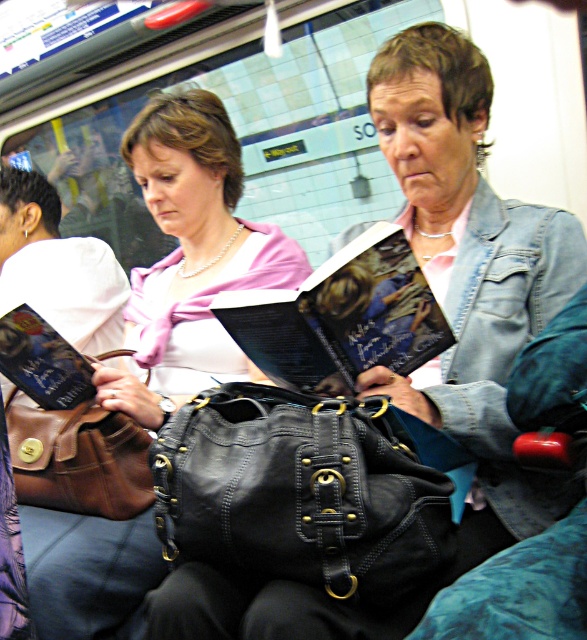
Question: Considering the real-world distances, which object is closest to the black leather bag at center?

Choices:
 (A) brown leather handbag at lower left
 (B) matte black purse at center

Answer: (A)

Question: Can you confirm if black leather bag at center is wider than hardcover book at center?

Choices:
 (A) no
 (B) yes

Answer: (B)

Question: Which of these objects is positioned farthest from the brown leather handbag at lower left?

Choices:
 (A) hardcover book at center
 (B) matte black purse at center

Answer: (A)

Question: Considering the real-world distances, which object is farthest from the matte black purse at center?

Choices:
 (A) hardcover book at center
 (B) black leather bag at center
 (C) brown leather handbag at lower left

Answer: (B)

Question: Where is matte black purse at center located in relation to brown leather handbag at lower left in the image?

Choices:
 (A) below
 (B) above

Answer: (B)

Question: Is black leather bag at center to the right of hardcover book at center from the viewer's perspective?

Choices:
 (A) yes
 (B) no

Answer: (B)